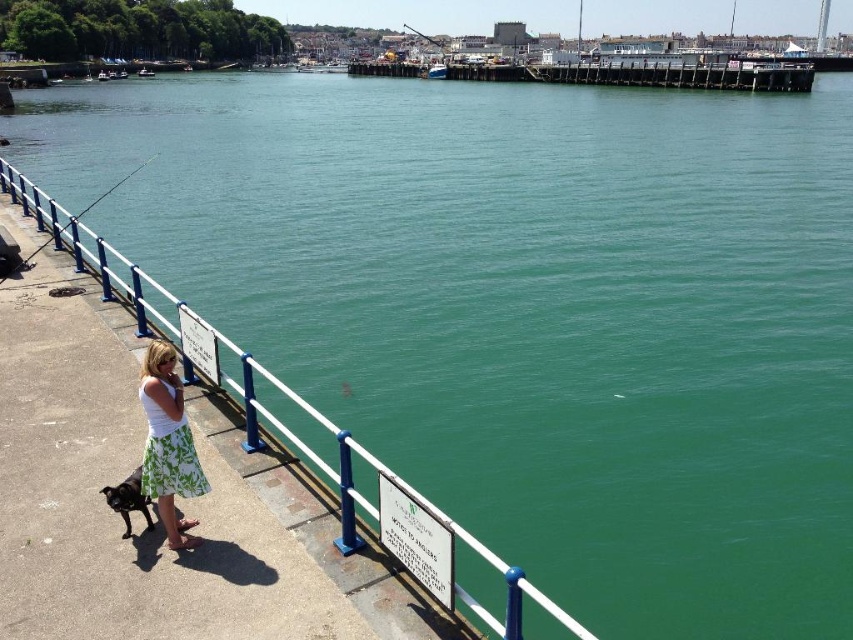
Question: Which point is closer to the camera taking this photo?

Choices:
 (A) (160, 492)
 (B) (422, 36)
 (C) (115, 504)
 (D) (90, 205)

Answer: (A)

Question: Based on their relative distances, which object is farther from the black glossy dog at lower left?

Choices:
 (A) metallic fishing pole at upper center
 (B) green floral skirt at lower left
 (C) metallic fishing pole at left

Answer: (A)

Question: Which is nearer to the green floral skirt at lower left?

Choices:
 (A) metallic fishing pole at left
 (B) black glossy dog at lower left

Answer: (B)

Question: Does black glossy dog at lower left appear on the right side of metallic fishing pole at left?

Choices:
 (A) no
 (B) yes

Answer: (B)

Question: Is black glossy dog at lower left bigger than metallic fishing pole at upper center?

Choices:
 (A) yes
 (B) no

Answer: (B)

Question: Does green floral skirt at lower left have a smaller size compared to metallic fishing pole at left?

Choices:
 (A) yes
 (B) no

Answer: (A)